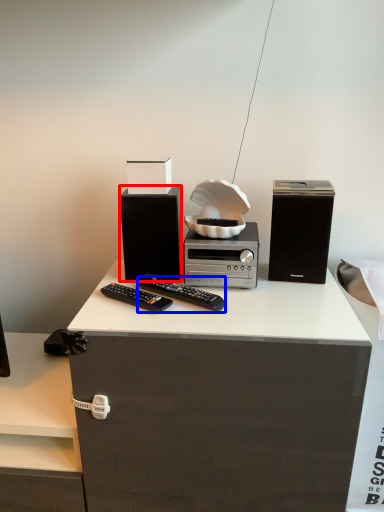
Question: Which point is further to the camera, speaker (highlighted by a red box) or remote control (highlighted by a blue box)?

Choices:
 (A) speaker
 (B) remote control

Answer: (A)